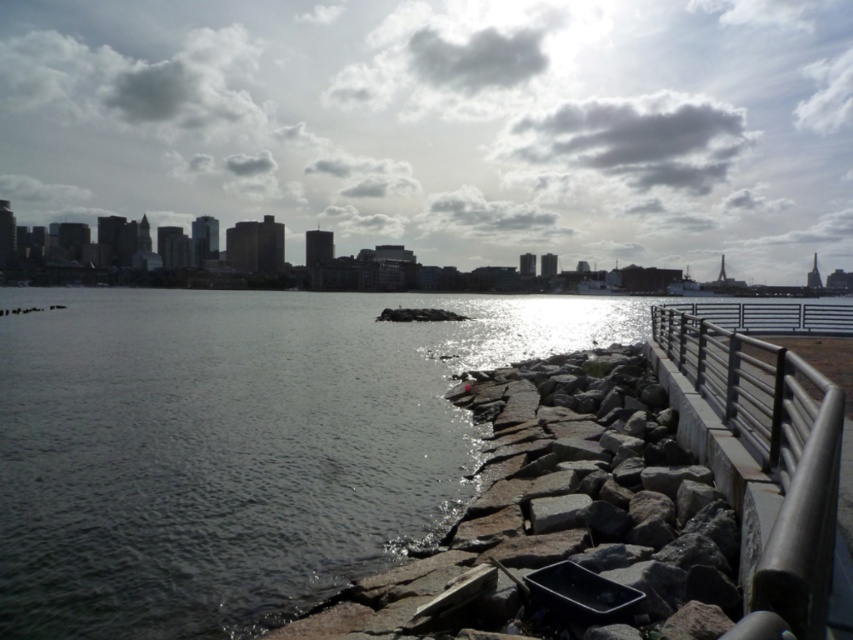
Can you confirm if dark gray water at center is positioned above satin silver railing at right?

Indeed, dark gray water at center is positioned over satin silver railing at right.

Measure the distance between dark gray water at center and satin silver railing at right.

dark gray water at center and satin silver railing at right are 41.35 meters apart.

Describe the element at coordinates (186, 372) in the screenshot. I see `dark gray water at center` at that location.

This screenshot has height=640, width=853. I want to click on dark gray water at center, so click(186, 372).